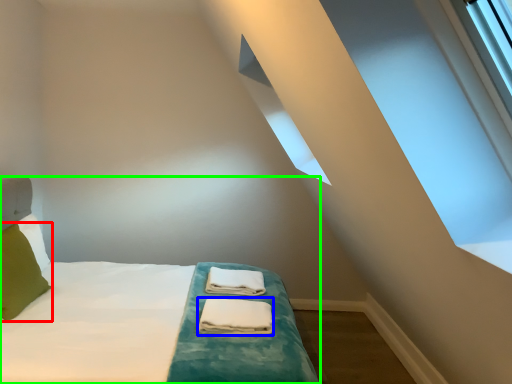
Question: Which object is the closest to the pillow (highlighted by a red box)? Choose among these: material (highlighted by a blue box) or bed (highlighted by a green box).

Choices:
 (A) material
 (B) bed

Answer: (B)